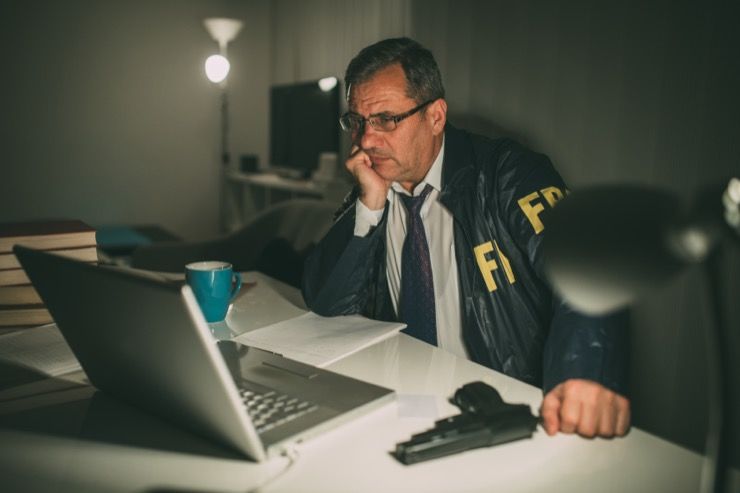
Where is `blue mug`? blue mug is located at coordinates (205, 291).